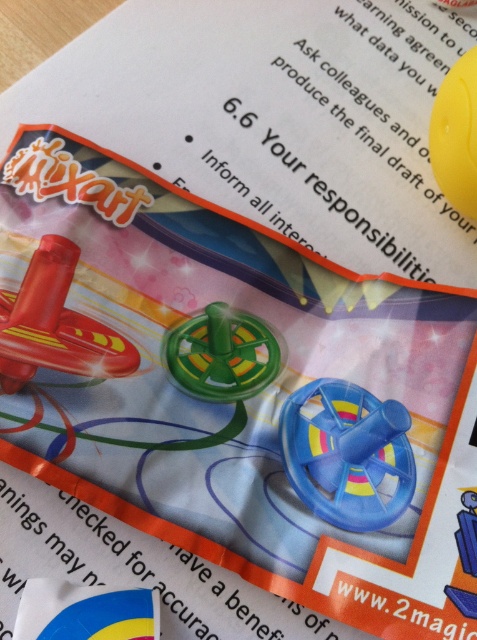
Does shiny red toy airplane at upper left appear over green plastic gear at center?

Indeed, shiny red toy airplane at upper left is positioned over green plastic gear at center.

Which is above, shiny red toy airplane at upper left or green plastic gear at center?

shiny red toy airplane at upper left is higher up.

This screenshot has height=640, width=477. What do you see at coordinates (54, 324) in the screenshot? I see `shiny red toy airplane at upper left` at bounding box center [54, 324].

You are a GUI agent. You are given a task and a screenshot of the screen. Output one action in this format:
    pyautogui.click(x=<x>, y=<y>)
    Task: Click on the shiny red toy airplane at upper left
    The width and height of the screenshot is (477, 640).
    Given the screenshot: What is the action you would take?
    pyautogui.click(x=54, y=324)

Is translucent blue spinner at center smaller than blue glossy flag at lower left?

Actually, translucent blue spinner at center might be larger than blue glossy flag at lower left.

Where is `translucent blue spinner at center`? The image size is (477, 640). translucent blue spinner at center is located at coordinates (346, 454).

Who is lower down, blue glossy flag at lower left or yellow rubber ball at upper right?

blue glossy flag at lower left is below.

Is point (26, 611) farther from camera compared to point (466, 115)?

No, it is in front of (466, 115).

Is point (103, 611) farther from camera compared to point (467, 118)?

No, (103, 611) is in front of (467, 118).

I want to click on blue glossy flag at lower left, so click(85, 611).